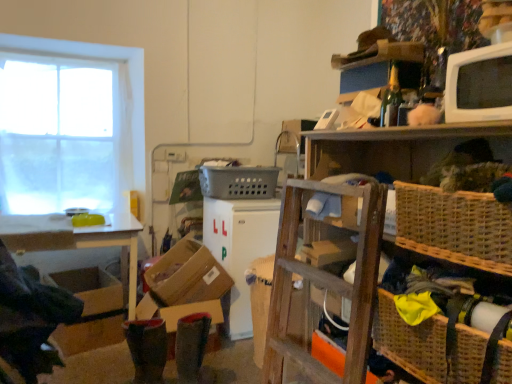
Question: Should I look upward or downward to see woven brown basket at right, which ranks as the second basket in back-to-front order?

Choices:
 (A) up
 (B) down

Answer: (B)

Question: Can you confirm if woven brown basket at lower right, which ranks as the first basket in front-to-back order, is taller than white glossy microwave at upper right, placed as the 1th appliance when sorted from top to bottom?

Choices:
 (A) no
 (B) yes

Answer: (B)

Question: Is woven brown basket at lower right, which ranks as the first basket in front-to-back order, positioned far away from white glossy microwave at upper right, the 2th appliance in the left-to-right sequence?

Choices:
 (A) yes
 (B) no

Answer: (B)

Question: From a real-world perspective, does woven brown basket at lower right, which appears as the first basket when ordered from the bottom, sit lower than white glossy microwave at upper right, which is counted as the first appliance, starting from the front?

Choices:
 (A) yes
 (B) no

Answer: (A)

Question: Can you confirm if woven brown basket at lower right, arranged as the 3th basket when viewed from the back, is wider than white glossy microwave at upper right, arranged as the 2th appliance when ordered from the bottom?

Choices:
 (A) yes
 (B) no

Answer: (A)

Question: Considering the relative sizes of woven brown basket at lower right, arranged as the 3th basket when viewed from the back, and white glossy microwave at upper right, the 2th appliance in the left-to-right sequence, in the image provided, is woven brown basket at lower right, arranged as the 3th basket when viewed from the back, thinner than white glossy microwave at upper right, the 2th appliance in the left-to-right sequence,?

Choices:
 (A) no
 (B) yes

Answer: (A)

Question: Is woven brown basket at lower right, which ranks as the first basket in front-to-back order, behind white glossy microwave at upper right, placed as the second appliance when sorted from back to front?

Choices:
 (A) no
 (B) yes

Answer: (A)

Question: Does brown cardboard box at lower left have a lesser width compared to white sheer curtain at left?

Choices:
 (A) yes
 (B) no

Answer: (B)

Question: Is brown cardboard box at lower left further to the viewer compared to white sheer curtain at left?

Choices:
 (A) no
 (B) yes

Answer: (A)

Question: Considering the relative sizes of brown cardboard box at lower left and white sheer curtain at left in the image provided, is brown cardboard box at lower left smaller than white sheer curtain at left?

Choices:
 (A) yes
 (B) no

Answer: (A)

Question: Does brown cardboard box at lower left have a lesser height compared to white sheer curtain at left?

Choices:
 (A) no
 (B) yes

Answer: (B)

Question: Is white sheer curtain at left a part of brown cardboard box at lower left?

Choices:
 (A) yes
 (B) no

Answer: (B)

Question: Is brown cardboard box at lower left in contact with white sheer curtain at left?

Choices:
 (A) yes
 (B) no

Answer: (B)

Question: From the image's perspective, is brown cardboard box at lower center located beneath white sheer curtain at left?

Choices:
 (A) no
 (B) yes

Answer: (B)